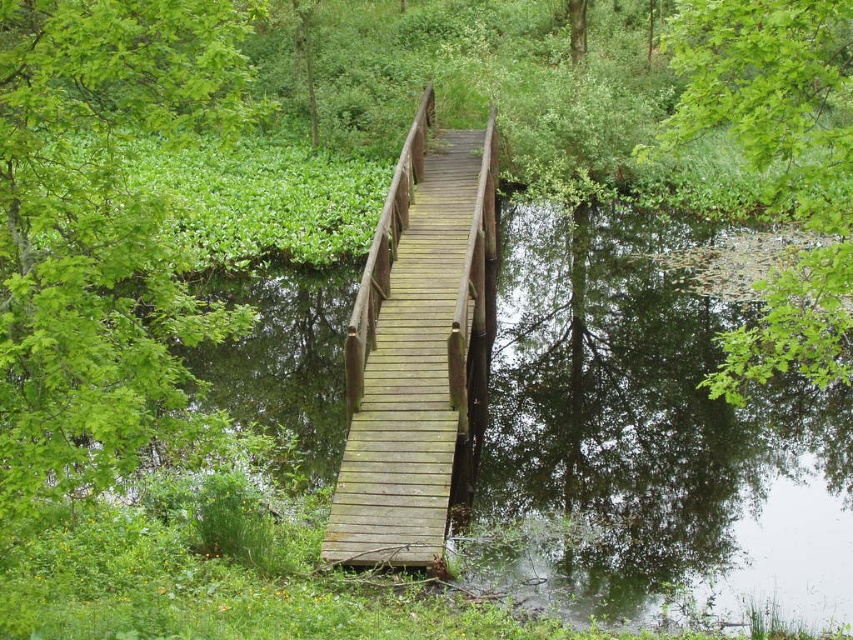
You are standing on the wooden bridge and looking towards the green leafy tree at upper left and the green leafy tree at upper right. Which tree appears closer to you?

The green leafy tree at upper left appears closer to you because it is positioned closer to the viewer compared to the green leafy tree at upper right.

From the picture: You are a hiker who wants to take a photo of the green leafy tree at upper left and the wooden bridge at center in the same frame. Based on the scene description, can you fit both in your camera viewfinder if your camera has a maximum viewing distance of 10 meters between objects?

The green leafy tree at upper left and wooden bridge at center are 9.21 meters apart, which is within the camera viewfinder maximum viewing distance of 10 meters. Yes, you can fit both in the same frame.